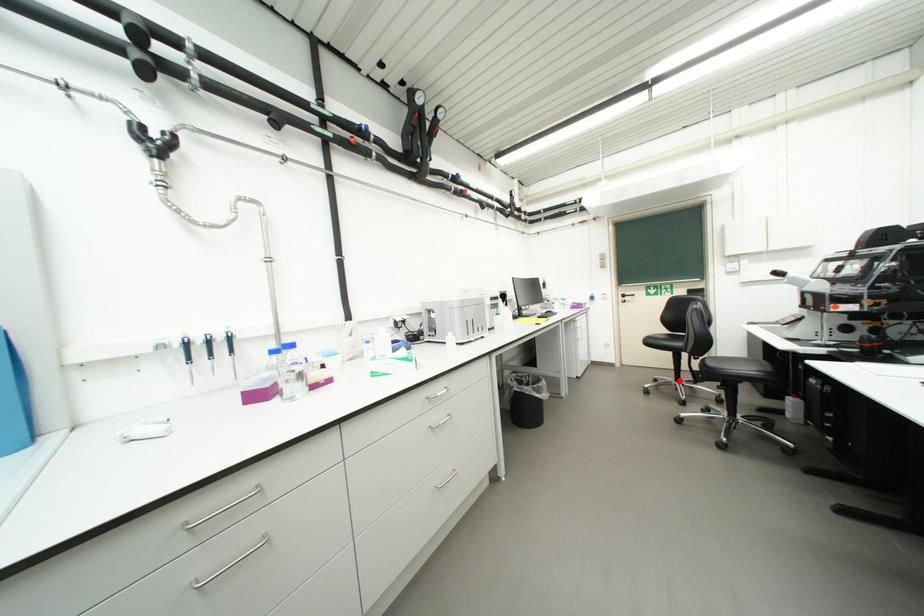
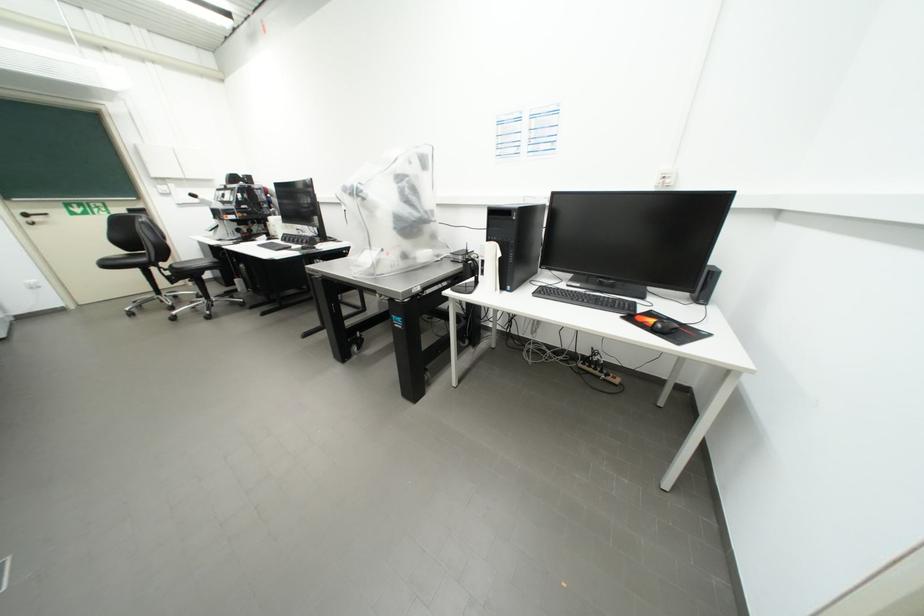
In the second image, find the point that corresponds to the highlighted location in the first image.

(160, 296)